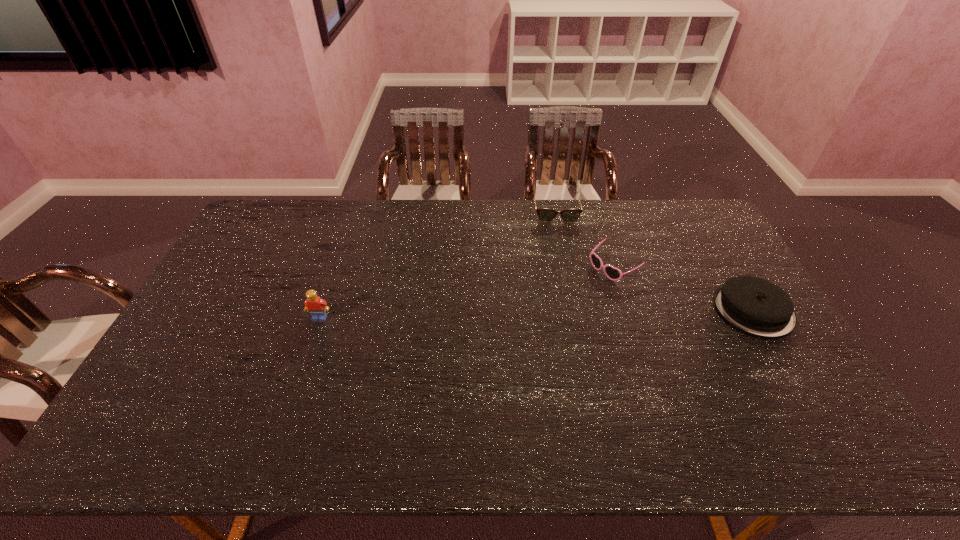
Where is `free spot located 0.330m at the front view of the farthest object`? This screenshot has height=540, width=960. free spot located 0.330m at the front view of the farthest object is located at coordinates (567, 286).

Image resolution: width=960 pixels, height=540 pixels. In order to click on vacant space located 0.370m at the front view of the farthest object in this screenshot , I will do `click(568, 295)`.

You are a GUI agent. You are given a task and a screenshot of the screen. Output one action in this format:
    pyautogui.click(x=<x>, y=<y>)
    Task: Click on the free space located at the front view of the farthest object
    The height and width of the screenshot is (540, 960).
    Given the screenshot: What is the action you would take?
    pyautogui.click(x=561, y=242)

Locate an element on the screen. This screenshot has width=960, height=540. object that is at the far edge is located at coordinates (544, 214).

Find the location of a particular element. The height and width of the screenshot is (540, 960). object that is at the right edge is located at coordinates (755, 306).

In the image, there is a desktop. Identify the location of free region at the far edge. This screenshot has width=960, height=540. (597, 225).

Locate an element on the screen. The width and height of the screenshot is (960, 540). vacant space at the left edge of the desktop is located at coordinates (205, 291).

I want to click on free space at the right edge, so coord(748,352).

In the image, there is a desktop. What are the coordinates of `vacant space at the far left corner` in the screenshot? It's located at (x=274, y=217).

Locate an element on the screen. The width and height of the screenshot is (960, 540). vacant area at the near left corner is located at coordinates (195, 381).